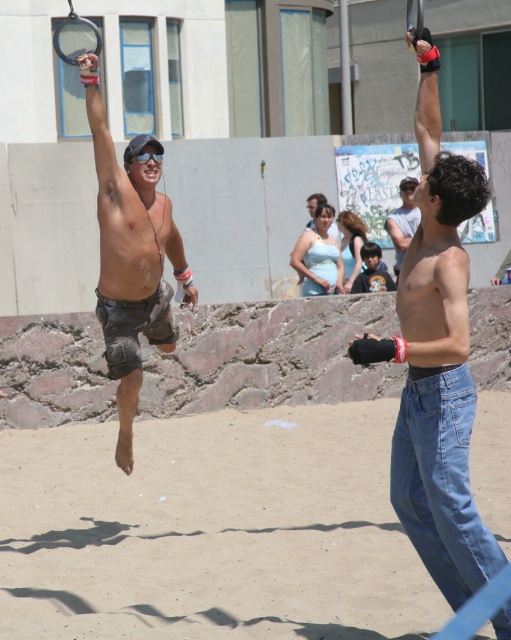
You are standing at the camera position and want to walk towards the sandy beach at lower center. How many steps would you need to take if each step covers 0.75 meters?

The sandy beach at lower center is 9.73 meters away from the camera. If each step covers 0.75 meters, you would need approximately 13 steps to reach it. This is calculated by dividing 9.73 by 0.75, which equals roughly 12.97 steps, rounded up to 13 steps.

You are a photographer at the event and want to capture a photo where the sandy beach at lower center is visible behind the matte black shorts at left. Is this possible given their positions?

The sandy beach at lower center is below matte black shorts at left, so the shorts are positioned in front of the beach. This means the photographer can capture the beach behind the shorts as they are not blocking it from view.

In the scene shown: You are a photographer at the beach scene. You need to capture a photo that includes both the matte black shorts at left and the dark blue shirt at center. Which object should you position closer to the left side of the camera frame?

The matte black shorts at left should be positioned closer to the left side of the camera frame since it is already on the left side of the dark blue shirt at center.